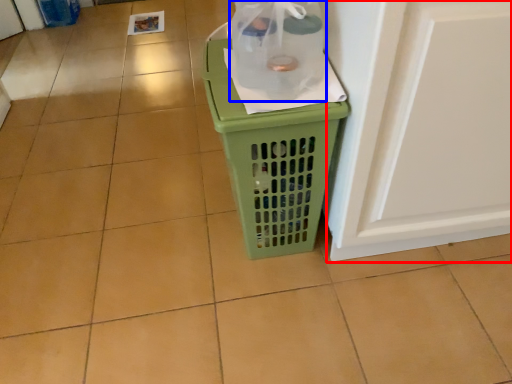
Question: Among these objects, which one is farthest to the camera, screen door (highlighted by a red box) or bottle (highlighted by a blue box)?

Choices:
 (A) screen door
 (B) bottle

Answer: (B)